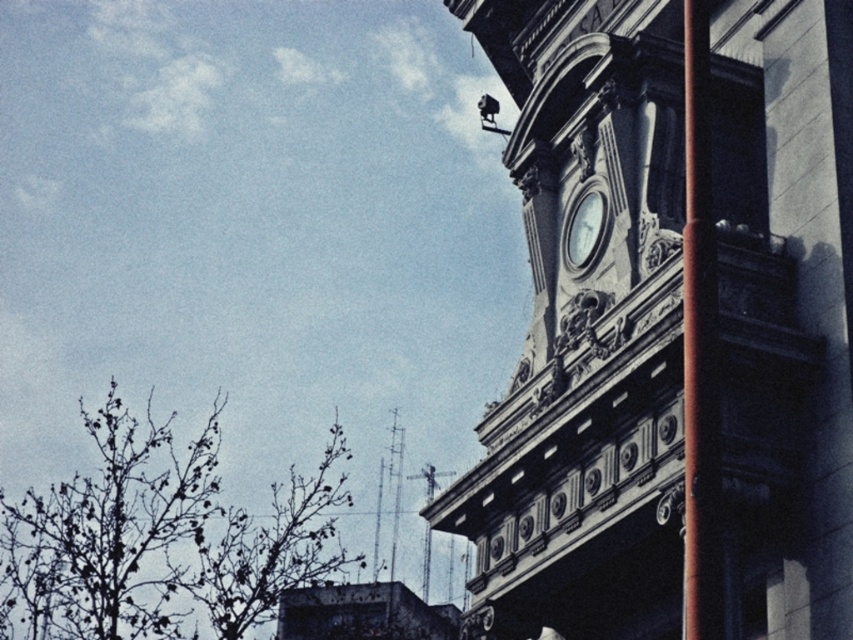
You are a maintenance worker needing to reach both the smooth brown pole at right and the white glossy clock at upper center. If your ladder can extend up to 15 meters, can you safely reach both objects without moving the ladder?

The smooth brown pole at right and the white glossy clock at upper center are 17.71 meters apart. Since your ladder can only extend up to 15 meters, you cannot safely reach both objects without moving the ladder because the distance between them exceeds the ladder length.

Consider the image. You are standing in front of the clock tower and notice two points marked on the building. The first point is at coordinate point (688, 161) and the second is at point (583, 248). Which point is closer to you?

Point (688, 161) is in front of point (583, 248), so it is closer to you.